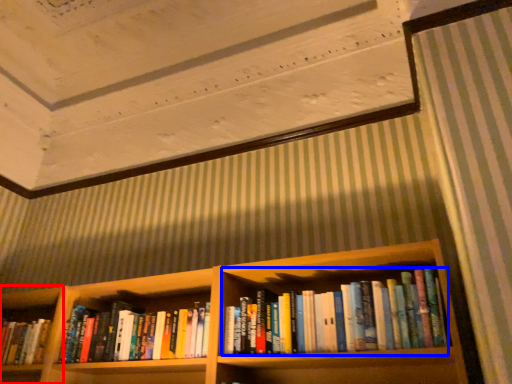
Question: Among these objects, which one is nearest to the camera, shelf (highlighted by a red box) or book (highlighted by a blue box)?

Choices:
 (A) shelf
 (B) book

Answer: (B)